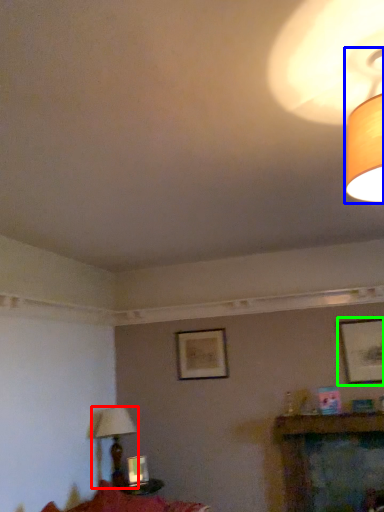
Question: Estimate the real-world distances between objects in this image. Which object is farther from lamp (highlighted by a red box), lamp (highlighted by a blue box) or picture frame (highlighted by a green box)?

Choices:
 (A) lamp
 (B) picture frame

Answer: (A)